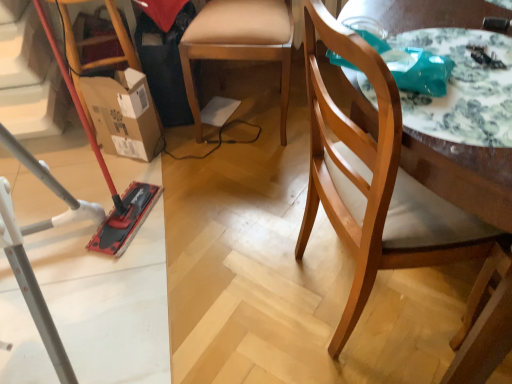
I want to click on free space that is in between wooden chair at right, the 2th chair when ordered from back to front, and cardboard box at left, so click(237, 221).